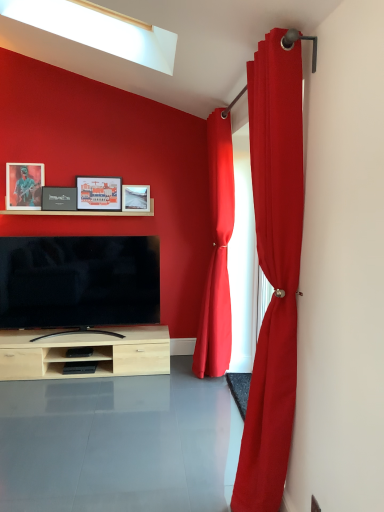
Question: Does wooden shelf at upper center have a greater height compared to matte black picture frame at center, which is counted as the third picture frame, starting from the right?

Choices:
 (A) yes
 (B) no

Answer: (B)

Question: Is wooden shelf at upper center smaller than matte black picture frame at center, which is counted as the third picture frame, starting from the right?

Choices:
 (A) no
 (B) yes

Answer: (A)

Question: Does wooden shelf at upper center appear on the left side of matte black picture frame at center, which appears as the second picture frame when viewed from the left?

Choices:
 (A) yes
 (B) no

Answer: (B)

Question: From the image's perspective, would you say wooden shelf at upper center is positioned over matte black picture frame at center, which appears as the second picture frame when viewed from the left?

Choices:
 (A) no
 (B) yes

Answer: (A)

Question: Can you confirm if wooden shelf at upper center is positioned to the right of matte black picture frame at center, which is counted as the third picture frame, starting from the right?

Choices:
 (A) no
 (B) yes

Answer: (B)

Question: From a real-world perspective, is wooden shelf at upper center on matte black picture frame at center, which is counted as the third picture frame, starting from the right?

Choices:
 (A) no
 (B) yes

Answer: (A)

Question: Is matte paper picture frame at upper center, which is the second picture frame in right-to-left order, positioned behind wooden shelf at upper center?

Choices:
 (A) yes
 (B) no

Answer: (A)

Question: Is matte paper picture frame at upper center, which is the second picture frame in right-to-left order, oriented towards wooden shelf at upper center?

Choices:
 (A) no
 (B) yes

Answer: (B)

Question: From a real-world perspective, does matte paper picture frame at upper center, which is the second picture frame in right-to-left order, sit lower than wooden shelf at upper center?

Choices:
 (A) yes
 (B) no

Answer: (B)

Question: Is matte paper picture frame at upper center, which is the second picture frame in right-to-left order, positioned with its back to wooden shelf at upper center?

Choices:
 (A) no
 (B) yes

Answer: (A)

Question: Is wooden shelf at upper center located within matte paper picture frame at upper center, which is the second picture frame in right-to-left order?

Choices:
 (A) yes
 (B) no

Answer: (B)

Question: Can you see matte paper picture frame at upper center, which is counted as the third picture frame, starting from the left, touching wooden shelf at upper center?

Choices:
 (A) yes
 (B) no

Answer: (B)

Question: Is matte black picture frame at upper left, positioned as the fourth picture frame in right-to-left order, shorter than matte wooden picture frame at center, which is counted as the 4th picture frame, starting from the left?

Choices:
 (A) yes
 (B) no

Answer: (B)